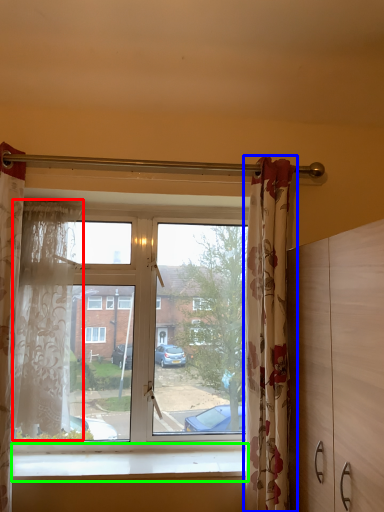
Question: Based on their relative distances, which object is farther from curtain (highlighted by a red box)? Choose from curtain (highlighted by a blue box) and window sill (highlighted by a green box).

Choices:
 (A) curtain
 (B) window sill

Answer: (A)